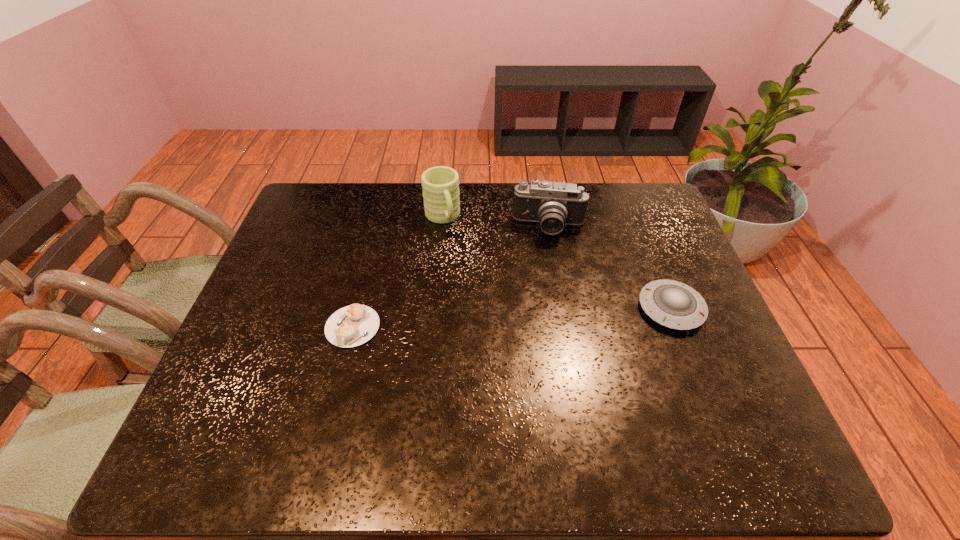
You are a GUI agent. You are given a task and a screenshot of the screen. Output one action in this format:
    pyautogui.click(x=<x>, y=<y>)
    Task: Click on the vacant point located between the rightmost object and the leftmost object
    
    Given the screenshot: What is the action you would take?
    pyautogui.click(x=512, y=318)

Select which object appears as the closest to the leftmost object. Please provide its 2D coordinates. Your answer should be formatted as a tuple, i.e. [(x, y)], where the tuple contains the x and y coordinates of a point satisfying the conditions above.

[(440, 184)]

Locate which object is the third closest to the camera. Please provide its 2D coordinates. Your answer should be formatted as a tuple, i.e. [(x, y)], where the tuple contains the x and y coordinates of a point satisfying the conditions above.

[(351, 326)]

The height and width of the screenshot is (540, 960). Identify the location of free location that satisfies the following two spatial constraints: 1. on the back side of the cappuccino; 2. on the right side of the camera. coord(377,227).

The image size is (960, 540). I want to click on blank area in the image that satisfies the following two spatial constraints: 1. on the back side of the cappuccino; 2. on the left side of the mug, so click(x=380, y=218).

The width and height of the screenshot is (960, 540). I want to click on vacant space that satisfies the following two spatial constraints: 1. on the front side of the saucer; 2. on the right side of the mug, so click(x=434, y=308).